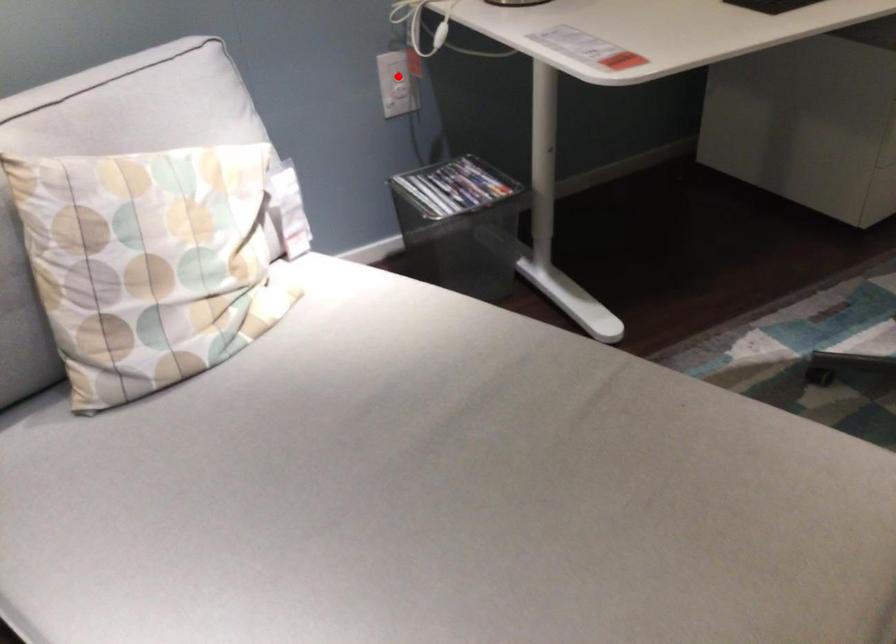
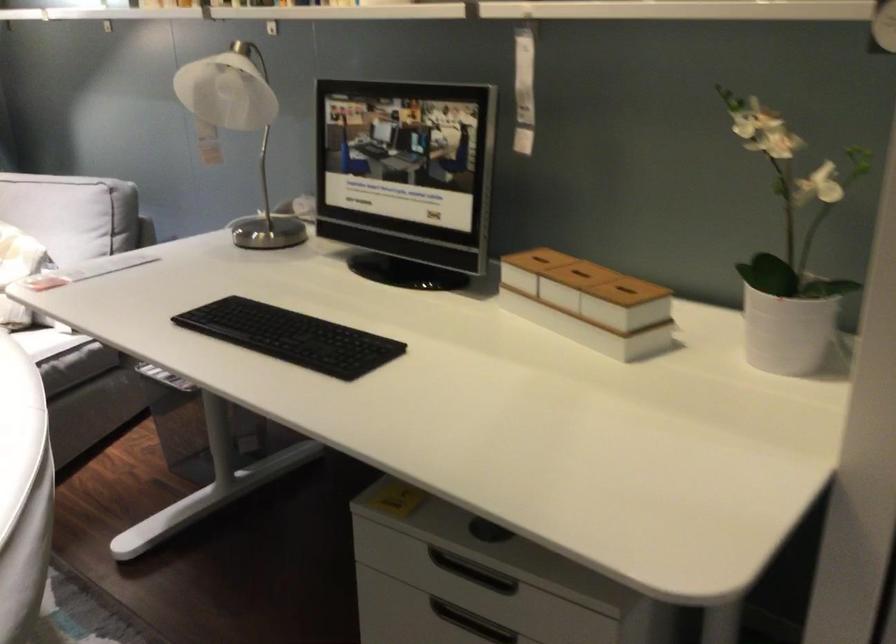
Question: I am providing you with two images of the same scene from different viewpoints. A red point is marked on the first image. At the location where the point appears in image 1, is it still visible in image 2?

Choices:
 (A) Yes
 (B) No

Answer: (B)